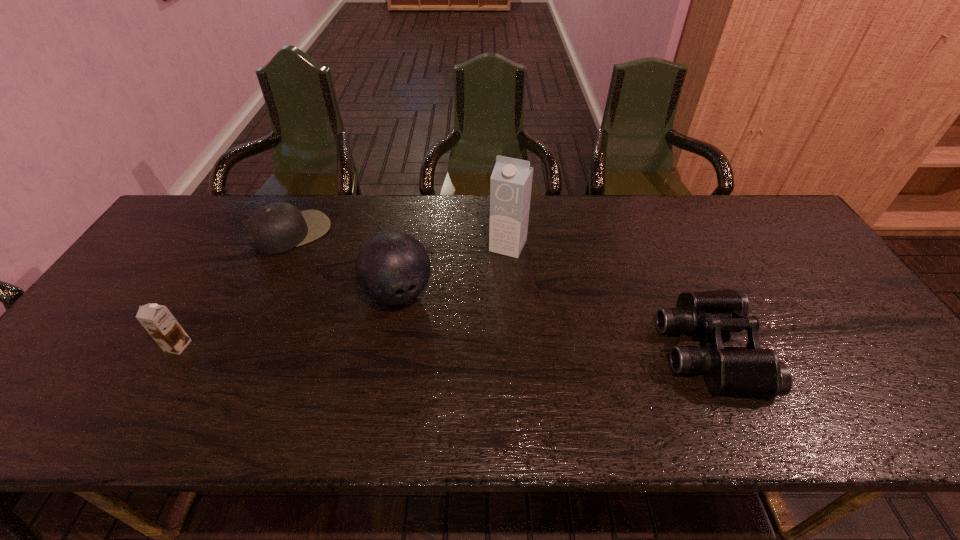
This screenshot has width=960, height=540. I want to click on free spot that satisfies the following two spatial constraints: 1. on the back side of the tallest object; 2. on the left side of the bowling ball, so click(x=407, y=246).

I want to click on free space that satisfies the following two spatial constraints: 1. on the front side of the binoculars; 2. on the front-facing side of the bowling ball, so click(x=388, y=349).